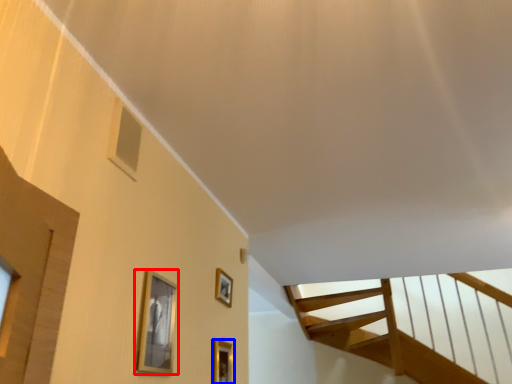
Question: Which of the following is the farthest to the observer, picture frame (highlighted by a red box) or picture frame (highlighted by a blue box)?

Choices:
 (A) picture frame
 (B) picture frame

Answer: (B)